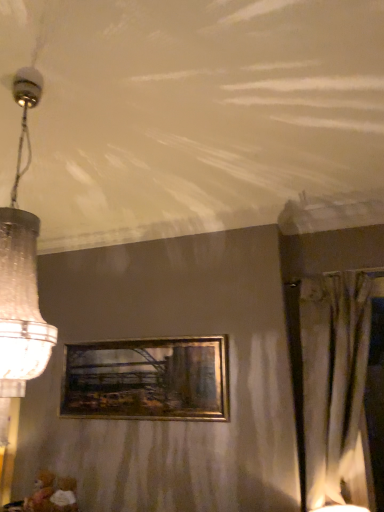
Question: Does gold metallic picture frame at center have a smaller size compared to clear glass chandelier at left?

Choices:
 (A) no
 (B) yes

Answer: (B)

Question: Can you see gold metallic picture frame at center touching clear glass chandelier at left?

Choices:
 (A) yes
 (B) no

Answer: (B)

Question: Is gold metallic picture frame at center at the right side of clear glass chandelier at left?

Choices:
 (A) no
 (B) yes

Answer: (B)

Question: Is the depth of gold metallic picture frame at center greater than that of clear glass chandelier at left?

Choices:
 (A) no
 (B) yes

Answer: (B)

Question: Is gold metallic picture frame at center bigger than clear glass chandelier at left?

Choices:
 (A) no
 (B) yes

Answer: (A)

Question: Does gold metallic picture frame at center turn towards clear glass chandelier at left?

Choices:
 (A) yes
 (B) no

Answer: (A)

Question: Is silky beige curtain at right outside of gold metallic picture frame at center?

Choices:
 (A) no
 (B) yes

Answer: (B)

Question: Can you confirm if silky beige curtain at right is smaller than gold metallic picture frame at center?

Choices:
 (A) no
 (B) yes

Answer: (A)

Question: Can you see silky beige curtain at right touching gold metallic picture frame at center?

Choices:
 (A) no
 (B) yes

Answer: (A)

Question: Is gold metallic picture frame at center a part of silky beige curtain at right?

Choices:
 (A) yes
 (B) no

Answer: (B)

Question: Is silky beige curtain at right further to the viewer compared to gold metallic picture frame at center?

Choices:
 (A) yes
 (B) no

Answer: (B)

Question: From a real-world perspective, does silky beige curtain at right stand above gold metallic picture frame at center?

Choices:
 (A) yes
 (B) no

Answer: (B)

Question: From the image's perspective, is clear glass chandelier at left located beneath silky beige curtain at right?

Choices:
 (A) yes
 (B) no

Answer: (B)